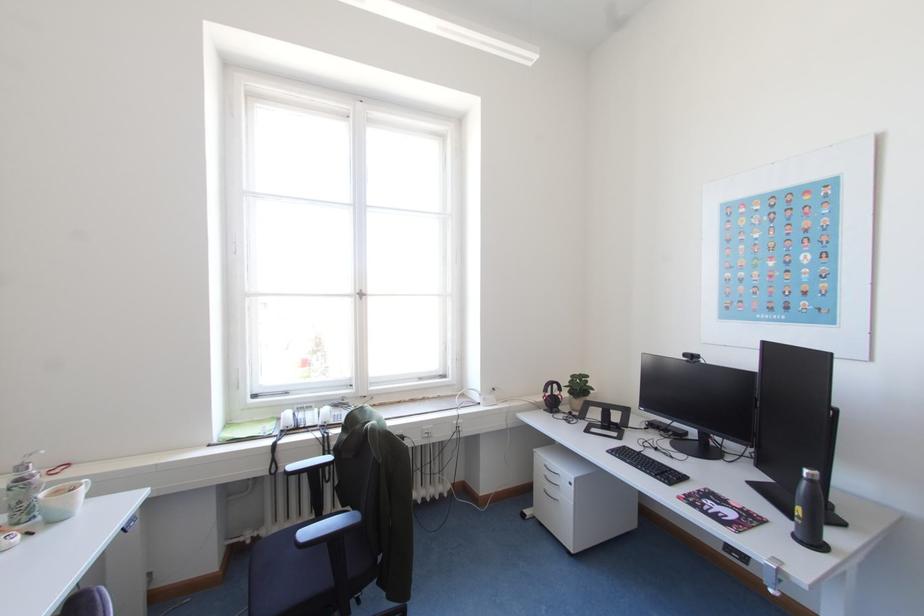
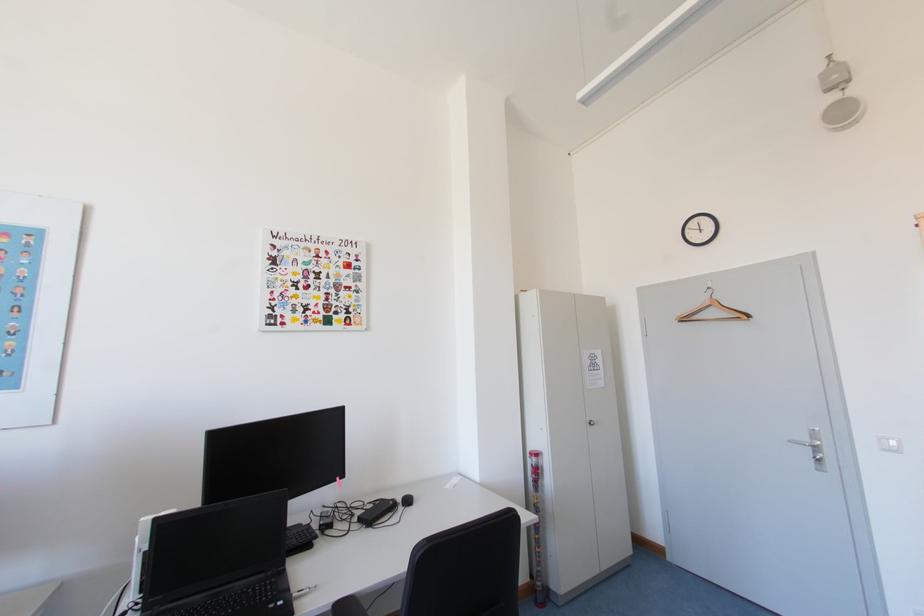
Question: The camera is either moving clockwise (left) or counter-clockwise (right) around the object. The first image is from the beginning of the video and the second image is from the end. Is the camera moving left or right when shooting the video?

Choices:
 (A) Left
 (B) Right

Answer: (A)